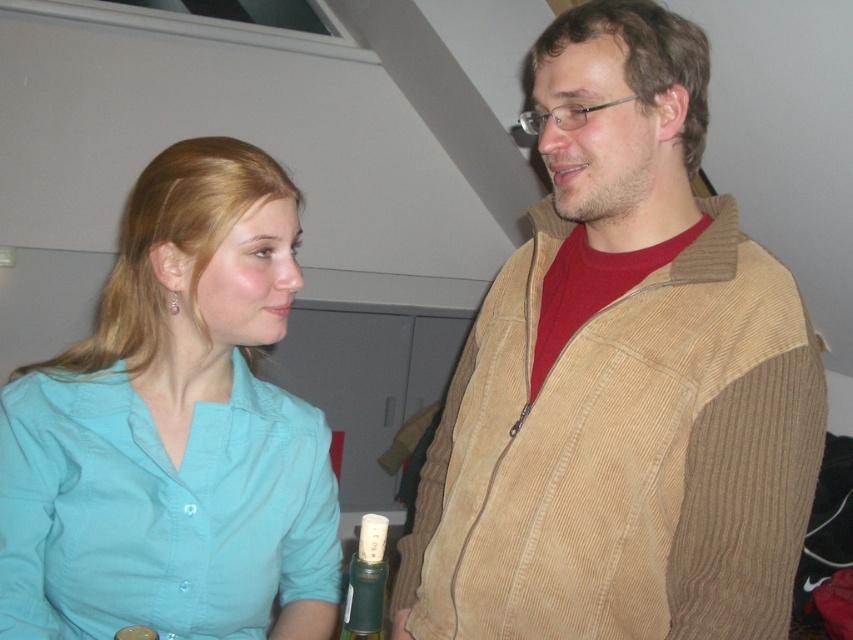
You are a photographer setting up a shot of the teal shirt at center and the green matte bottle at lower center. Which object should you focus on first if you want to capture both clearly in the frame?

The teal shirt at center is larger in size than the green matte bottle at lower center, so you should focus on the teal shirt at center first to ensure it is in clear focus before adjusting for the smaller bottle.

You are a photographer setting up a shoot in this room. You need to ensure that the teal shirt at center doesn not cover the green matte bottle at lower center in the photo. Based on their positions, is this possible?

The teal shirt at center is positioned over the green matte bottle at lower center, so adjusting the camera angle or moving the bottle slightly could help ensure the bottle is visible without being covered by the shirt.

You are standing at the camera position and want to reach point (207, 589). Can you walk directly to that point without moving around any obstacles?

The distance between point (207, 589) and the camera is 36.30 inches, so yes, you can walk directly to that point without moving around any obstacles since there are no mentioned obstacles in the scene.